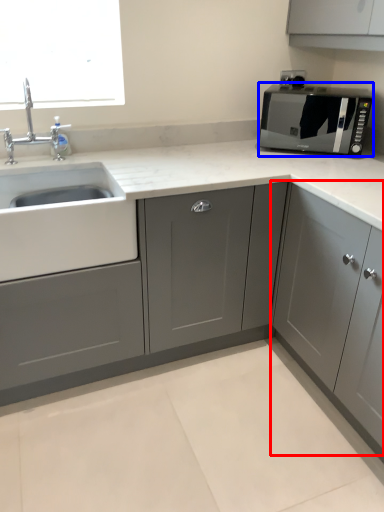
Question: Among these objects, which one is nearest to the camera, cabinetry (highlighted by a red box) or microwave oven (highlighted by a blue box)?

Choices:
 (A) cabinetry
 (B) microwave oven

Answer: (A)